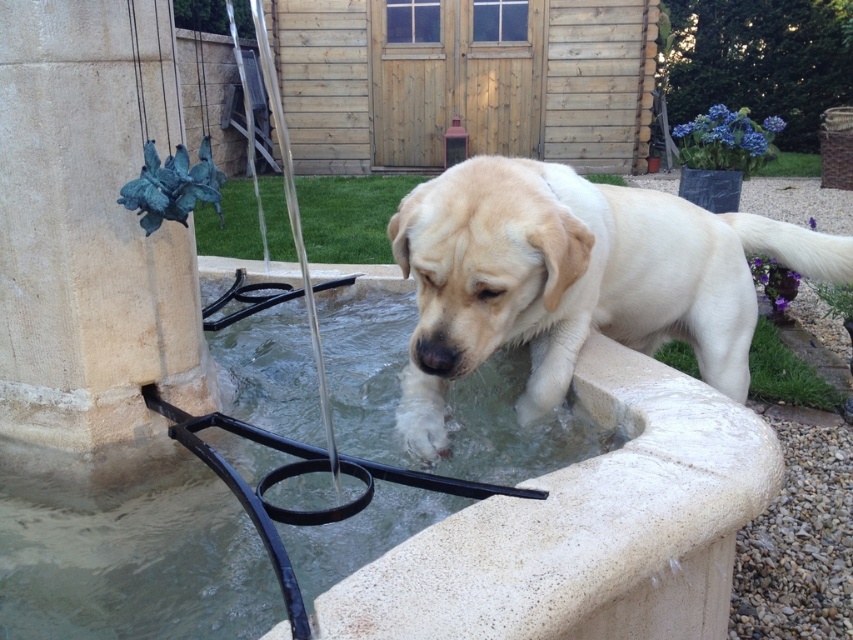
Between clear water at center and green patina stone pillar at left, which one is positioned lower?

clear water at center is lower down.

Can you confirm if clear water at center is shorter than green patina stone pillar at left?

Yes.

Between point (27, 604) and point (44, 61), which one is positioned in front?

Point (27, 604)

Where is `clear water at center`? The height and width of the screenshot is (640, 853). clear water at center is located at coordinates (126, 550).

Where is `clear water at center`? The height and width of the screenshot is (640, 853). clear water at center is located at coordinates (126, 550).

Does clear water at center have a larger size compared to light beige fur at center?

Indeed, clear water at center has a larger size compared to light beige fur at center.

Which is behind, point (233, 525) or point (433, 410)?

The point (433, 410) is more distant.

Where is `clear water at center`? This screenshot has height=640, width=853. clear water at center is located at coordinates (126, 550).

Is point (15, 317) farther from viewer compared to point (492, 308)?

Yes, it is behind point (492, 308).

Can you confirm if green patina stone pillar at left is positioned above light beige fur at center?

Correct, green patina stone pillar at left is located above light beige fur at center.

This screenshot has height=640, width=853. Describe the element at coordinates (84, 241) in the screenshot. I see `green patina stone pillar at left` at that location.

Locate an element on the screen. green patina stone pillar at left is located at coordinates (84, 241).